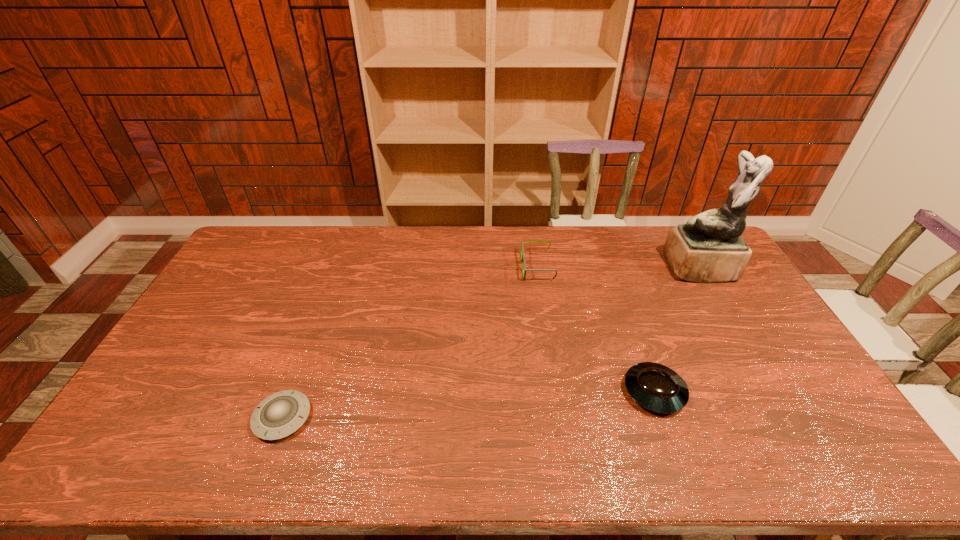
Find the location of a particular element. This screenshot has height=540, width=960. vacant area at the far edge of the desktop is located at coordinates (436, 249).

Identify the location of blank space at the near edge of the desktop. (675, 467).

I want to click on free space at the left edge of the desktop, so click(x=164, y=380).

The width and height of the screenshot is (960, 540). Find the location of `vacant point at the far left corner`. vacant point at the far left corner is located at coordinates (262, 232).

You are a GUI agent. You are given a task and a screenshot of the screen. Output one action in this format:
    pyautogui.click(x=<x>, y=<y>)
    Task: Click on the vacant point located between the left saucer and the taller saucer
    
    Given the screenshot: What is the action you would take?
    pyautogui.click(x=468, y=404)

Where is `free spot between the rightmost object and the second object from right to left`? This screenshot has height=540, width=960. free spot between the rightmost object and the second object from right to left is located at coordinates (677, 330).

This screenshot has width=960, height=540. I want to click on free space between the second object from left to right and the rightmost object, so click(x=618, y=268).

Image resolution: width=960 pixels, height=540 pixels. I want to click on vacant space that is in between the taller saucer and the left saucer, so click(468, 404).

You are a GUI agent. You are given a task and a screenshot of the screen. Output one action in this format:
    pyautogui.click(x=<x>, y=<y>)
    Task: Click on the free area in between the rightmost object and the second object from left to right
    
    Given the screenshot: What is the action you would take?
    pyautogui.click(x=618, y=268)

Where is `free space between the third object from right to left and the left saucer`? free space between the third object from right to left and the left saucer is located at coordinates (410, 342).